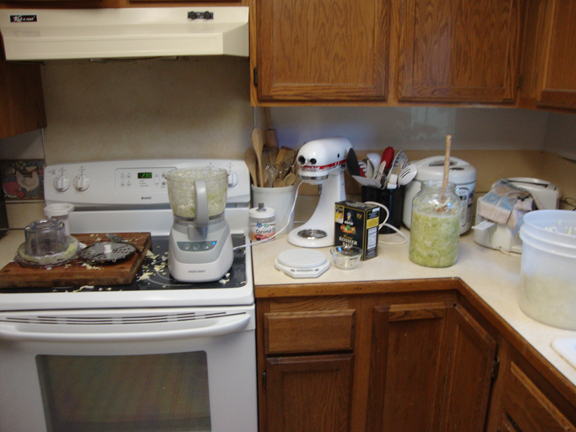
Identify the location of knobs. The image size is (576, 432). (82, 184), (60, 182), (231, 177).